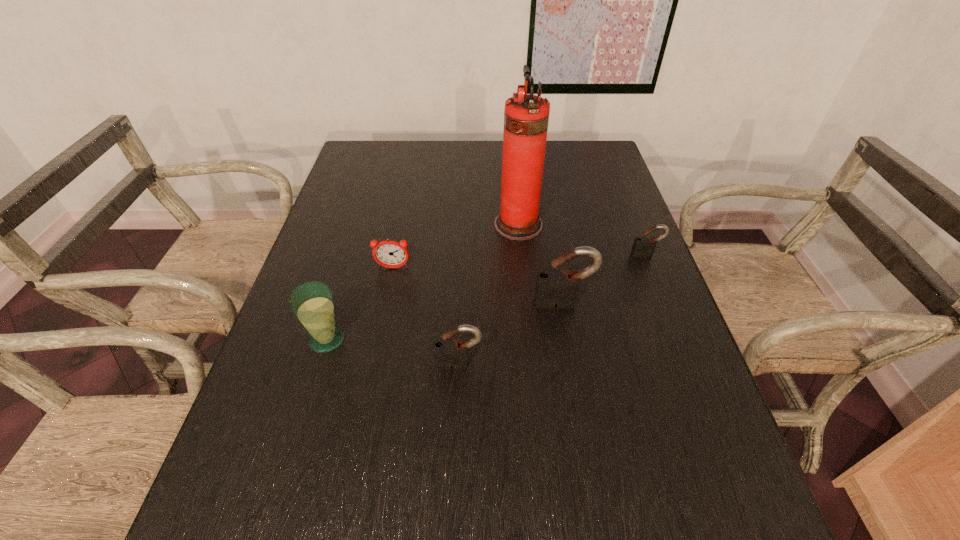
In order to click on the fourth nearest object in this screenshot , I will do `click(391, 254)`.

Find the location of `the second object from left to right`. the second object from left to right is located at coordinates (391, 254).

At what (x,y) coordinates should I click in order to perform the action: click on free space located with the keyhole on the front of the third shortest object. Please return your answer as a coordinate pair (x, y). The height and width of the screenshot is (540, 960). Looking at the image, I should click on (458, 395).

The image size is (960, 540). In order to click on vacant space located 0.230m with the keyhole on the front of the tallest padlock in this screenshot , I will do `click(580, 397)`.

You are a GUI agent. You are given a task and a screenshot of the screen. Output one action in this format:
    pyautogui.click(x=<x>, y=<y>)
    Task: Click on the free space located with the keyhole on the front of the rightmost object
    
    Given the screenshot: What is the action you would take?
    pyautogui.click(x=656, y=279)

The image size is (960, 540). In order to click on free space located 0.320m at the discharge end of the fire extinguisher in this screenshot , I will do (x=382, y=225).

Identify the location of free location located 0.390m at the discharge end of the fire extinguisher. This screenshot has height=540, width=960. (358, 225).

You are a GUI agent. You are given a task and a screenshot of the screen. Output one action in this format:
    pyautogui.click(x=<x>, y=<y>)
    Task: Click on the vacant space located at the discharge end of the fire extinguisher
    Image resolution: width=960 pixels, height=540 pixels.
    Given the screenshot: What is the action you would take?
    pyautogui.click(x=449, y=225)

Where is `free space located on the back of the second nearest object`? This screenshot has width=960, height=540. free space located on the back of the second nearest object is located at coordinates (354, 249).

Where is `vacant space located on the front-facing side of the third farthest object`? vacant space located on the front-facing side of the third farthest object is located at coordinates (373, 368).